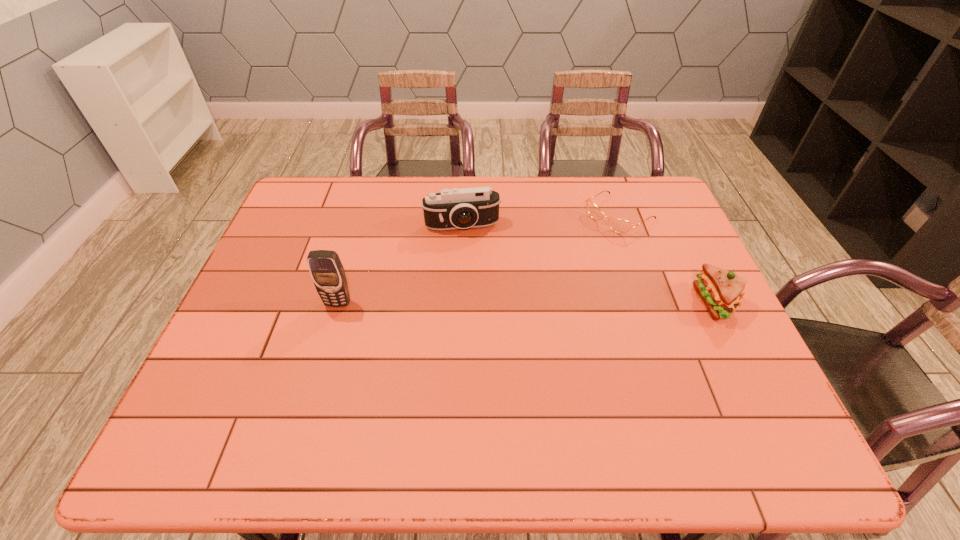
This screenshot has height=540, width=960. In order to click on free space on the desktop that is between the leftmost object and the rightmost object and is positioned on the front-facing side of the second object from right to left in this screenshot , I will do `click(490, 303)`.

Locate an element on the screen. vacant spot on the desktop that is between the tallest object and the sandwich and is positioned on the front lens of the camera is located at coordinates (474, 303).